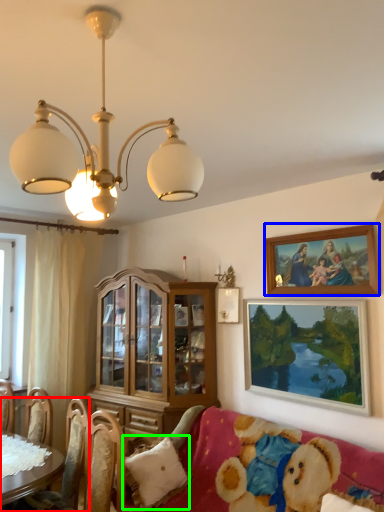
Question: Based on their relative distances, which object is farther from chair (highlighted by a red box)? Choose from picture frame (highlighted by a blue box) and pillow (highlighted by a green box).

Choices:
 (A) picture frame
 (B) pillow

Answer: (A)